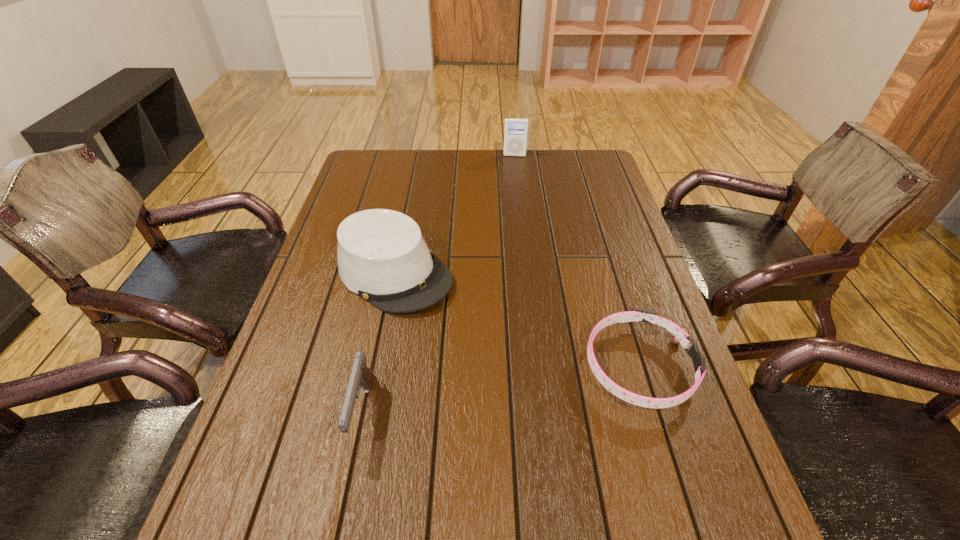
At what (x,y) coordinates should I click in order to perform the action: click on pistol. Please return your answer as a coordinate pair (x, y). Looking at the image, I should click on (361, 375).

At what (x,y) coordinates should I click in order to perform the action: click on the shortest object. Please return your answer as a coordinate pair (x, y). Image resolution: width=960 pixels, height=540 pixels. Looking at the image, I should click on (680, 336).

In order to click on the rightmost object in this screenshot , I will do `click(680, 336)`.

The height and width of the screenshot is (540, 960). Find the location of `the third nearest object`. the third nearest object is located at coordinates (382, 256).

Identify the location of iPod. This screenshot has width=960, height=540. tap(516, 129).

Identify the location of the farthest object. Image resolution: width=960 pixels, height=540 pixels. (516, 129).

Locate an element on the screen. vacant space situated 0.060m at the barrel of the pistol is located at coordinates (347, 487).

You are a GUI agent. You are given a task and a screenshot of the screen. Output one action in this format:
    pyautogui.click(x=<x>, y=<y>)
    Task: Click on the vacant space located on the front-facing side of the second farthest object
    
    Given the screenshot: What is the action you would take?
    pyautogui.click(x=473, y=328)

This screenshot has width=960, height=540. I want to click on free space located on the front-facing side of the second farthest object, so click(x=462, y=320).

The width and height of the screenshot is (960, 540). What are the coordinates of `vacant space located 0.310m on the front-facing side of the second farthest object` in the screenshot? It's located at (534, 371).